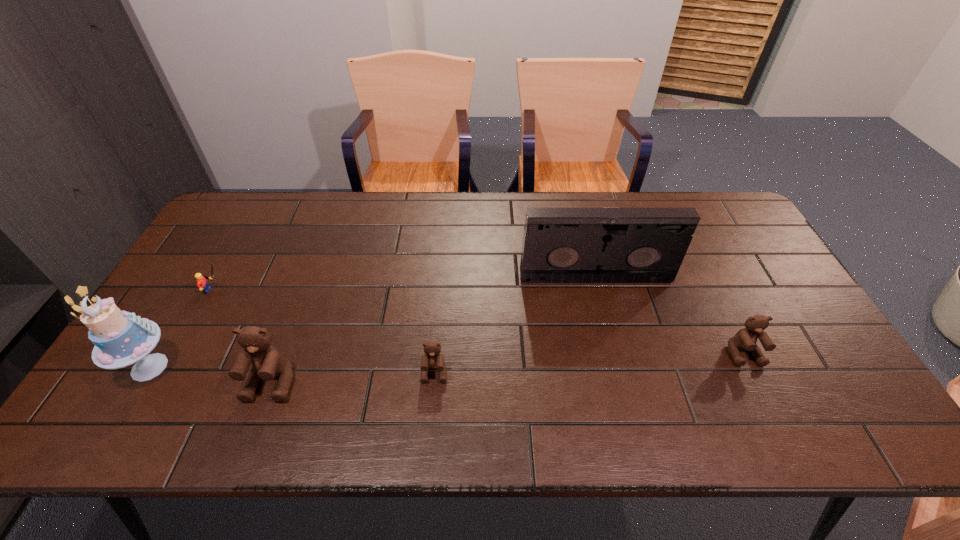
Locate an element on the screen. The width and height of the screenshot is (960, 540). vacant area at the far left corner of the desktop is located at coordinates (248, 209).

The height and width of the screenshot is (540, 960). In the image, there is a desktop. In order to click on vacant space at the far right corner in this screenshot , I will do `click(706, 230)`.

Find the location of a particular element. This screenshot has width=960, height=540. free region at the near right corner of the desktop is located at coordinates (794, 367).

You are a GUI agent. You are given a task and a screenshot of the screen. Output one action in this format:
    pyautogui.click(x=<x>, y=<y>)
    Task: Click on the vacant area that lies between the cake and the second shortest teddy bear
    The height and width of the screenshot is (540, 960).
    Given the screenshot: What is the action you would take?
    pyautogui.click(x=446, y=361)

Identify the location of empty location between the rightmost teddy bear and the leftmost teddy bear. This screenshot has height=540, width=960. (508, 368).

Identify the location of blank region between the second teddy bear from left to right and the farthest object. Image resolution: width=960 pixels, height=540 pixels. (515, 325).

Locate an element on the screen. unoccupied position between the second teddy bear from right to left and the farthest object is located at coordinates (515, 325).

Image resolution: width=960 pixels, height=540 pixels. What are the coordinates of `vacant area that lies between the shortest teddy bear and the fourth object from right to left` in the screenshot? It's located at (353, 377).

The height and width of the screenshot is (540, 960). What are the coordinates of `free space between the fourth object from left to right and the rightmost teddy bear` in the screenshot? It's located at (589, 363).

Where is `blank region between the third object from left to right and the shortest teddy bear`? blank region between the third object from left to right and the shortest teddy bear is located at coordinates (353, 377).